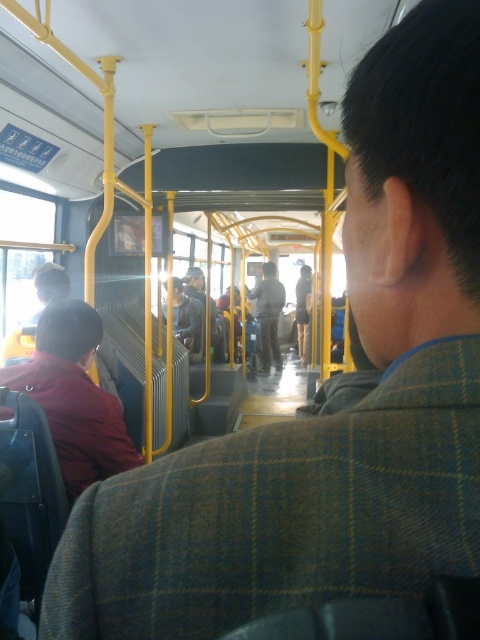
Question: Which point appears closest to the camera in this image?

Choices:
 (A) (188, 272)
 (B) (62, 460)
 (C) (259, 310)

Answer: (B)

Question: Does maroon fabric jacket at left appear on the right side of dark gray leather jacket at center?

Choices:
 (A) no
 (B) yes

Answer: (A)

Question: Does dark gray fabric jacket at center appear on the left side of dark gray sweater at center?

Choices:
 (A) yes
 (B) no

Answer: (B)

Question: Where is dark gray fabric jacket at center located in relation to dark gray sweater at center in the image?

Choices:
 (A) right
 (B) left

Answer: (A)

Question: Which point appears farthest from the camera in this image?

Choices:
 (A) (271, 308)
 (B) (213, 336)
 (C) (173, 321)
 (D) (112, 445)

Answer: (A)

Question: Which of the following is the closest to the observer?

Choices:
 (A) (186, 304)
 (B) (201, 305)
 (C) (60, 465)
 (D) (268, 348)

Answer: (C)